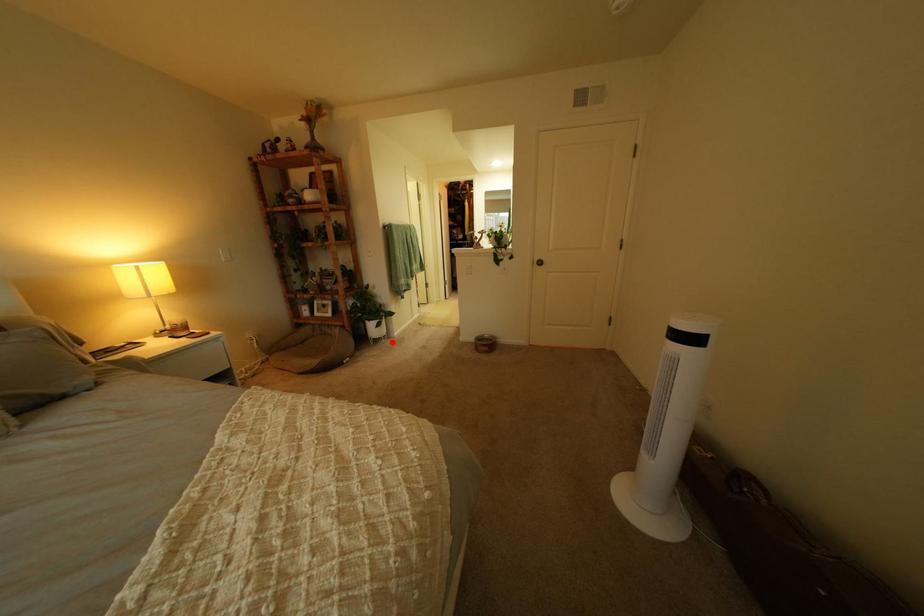
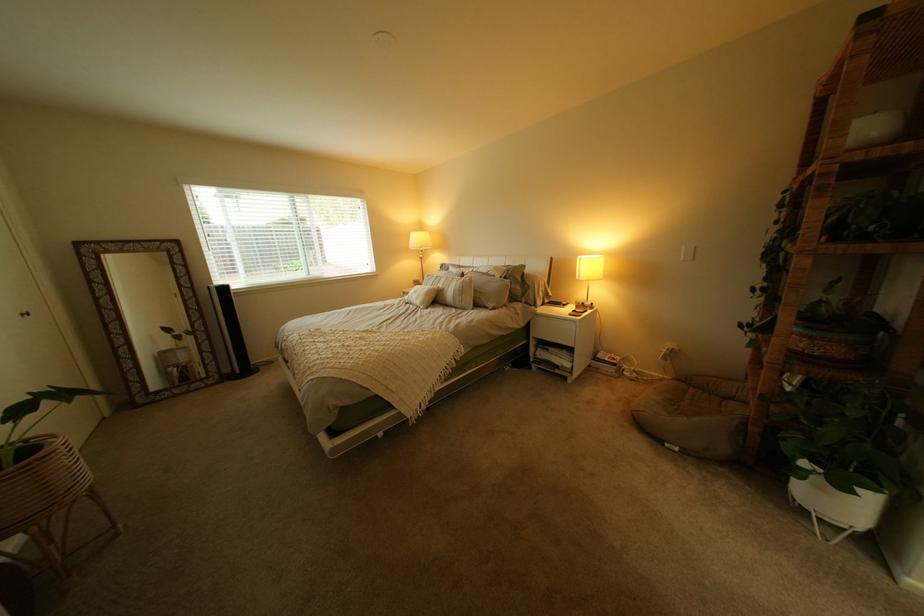
Question: I am providing you with two images of the same scene from different viewpoints. Image1 has a red point marked. In image2, the corresponding 3D location appears at what relative position? Reply with the corresponding letter.

Choices:
 (A) Closer
 (B) Farther

Answer: (B)